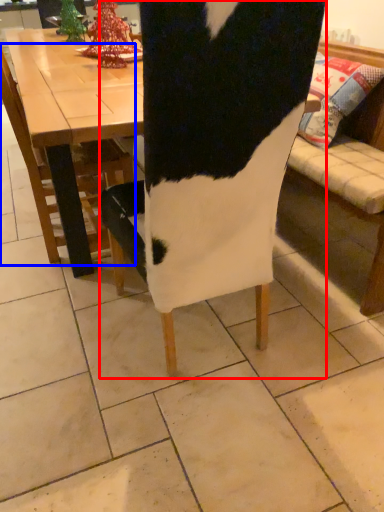
Question: Which object is further to the camera taking this photo, chair (highlighted by a red box) or chair (highlighted by a blue box)?

Choices:
 (A) chair
 (B) chair

Answer: (B)